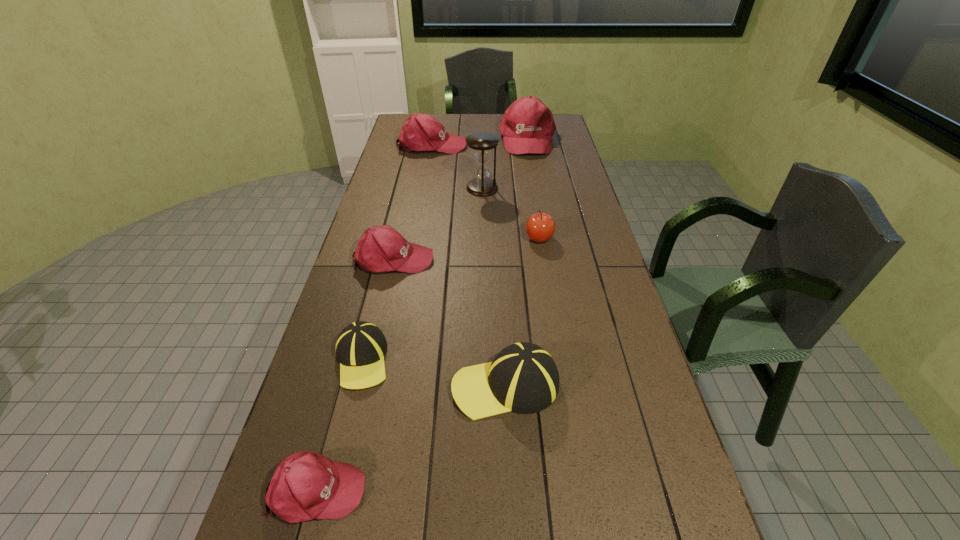
You are a GUI agent. You are given a task and a screenshot of the screen. Output one action in this format:
    pyautogui.click(x=<x>, y=<y>)
    Task: Click on the vacant space that satisfies the following two spatial constraints: 1. at the front of the second tallest baseball cap with the brim; 2. with the brim of the left black baseball cap facing forward
    This screenshot has height=540, width=960.
    Given the screenshot: What is the action you would take?
    pyautogui.click(x=393, y=360)